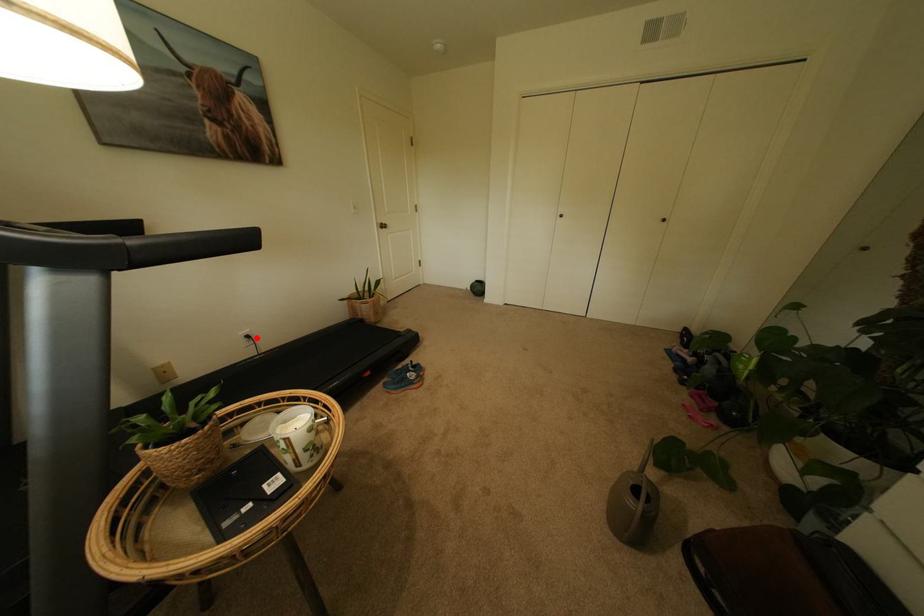
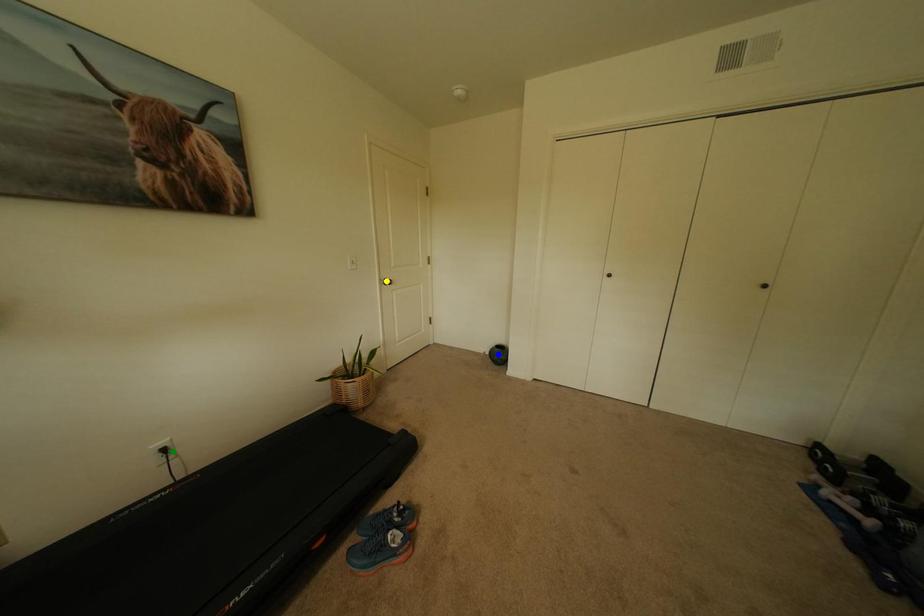
Question: I am providing you with two images of the same scene from different viewpoints. A red point is marked on the first image. You are given multiple points on the second image. Which point in image 2 represents the same 3d spot as the red point in image 1?

Choices:
 (A) blue point
 (B) green point
 (C) yellow point

Answer: (B)